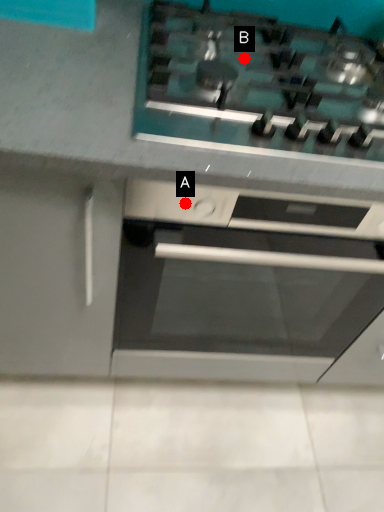
Question: Two points are circled on the image, labeled by A and B beside each circle. Which point appears closest to the camera in this image?

Choices:
 (A) A is closer
 (B) B is closer

Answer: (A)